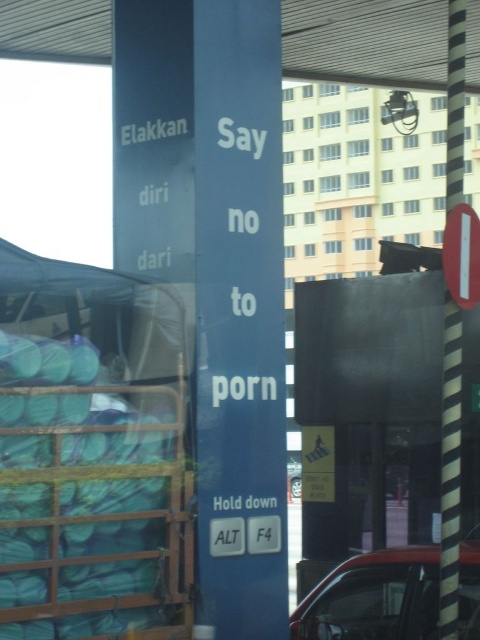
Question: Which object appears farthest from the camera in this image?

Choices:
 (A) red glossy car at lower right
 (B) metallic silver car at center

Answer: (A)

Question: Does red glossy car at lower right appear on the left side of metallic silver car at center?

Choices:
 (A) yes
 (B) no

Answer: (B)

Question: Is the position of red glossy car at lower right more distant than that of metallic silver car at center?

Choices:
 (A) yes
 (B) no

Answer: (A)

Question: Which object appears farthest from the camera in this image?

Choices:
 (A) metallic silver car at center
 (B) red glossy car at lower right

Answer: (B)

Question: Is the position of red glossy car at lower right more distant than that of metallic silver car at center?

Choices:
 (A) yes
 (B) no

Answer: (A)